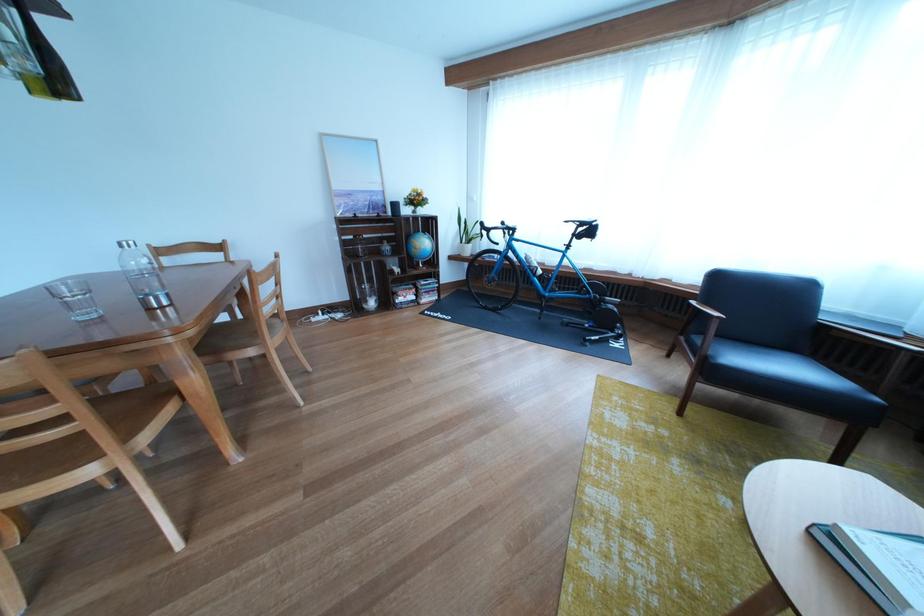
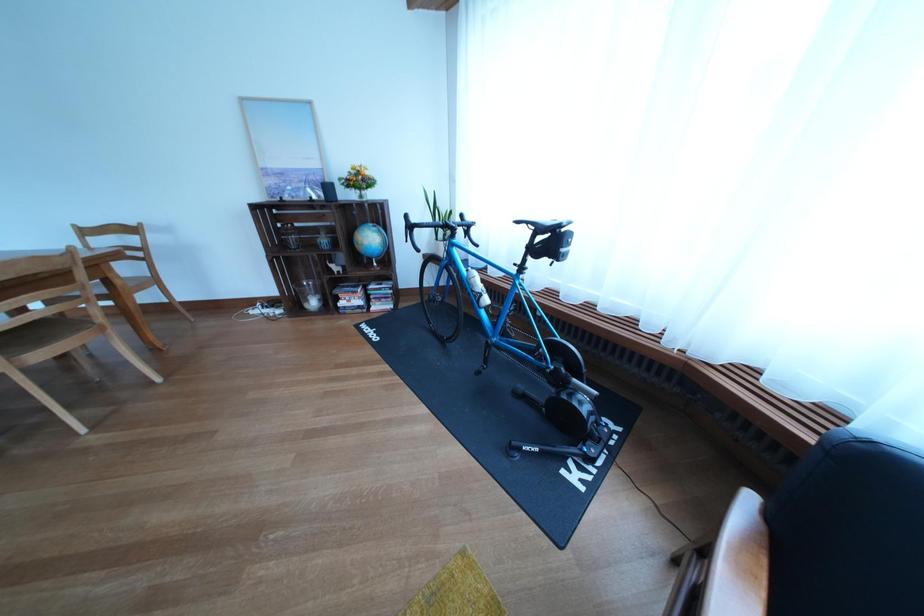
Find the pixel in the second image that matches point (380, 307) in the first image.

(321, 306)